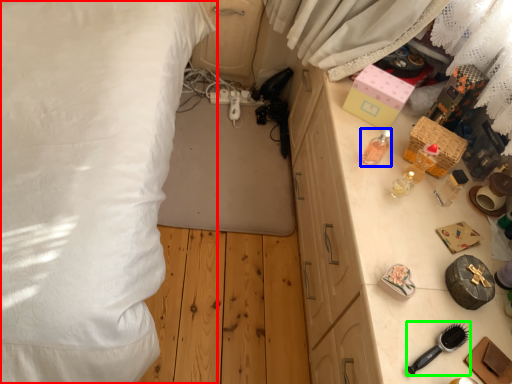
Question: Which object is the farthest from bed (highlighted by a red box)? Choose among these: toiletry (highlighted by a blue box) or brush (highlighted by a green box).

Choices:
 (A) toiletry
 (B) brush

Answer: (B)